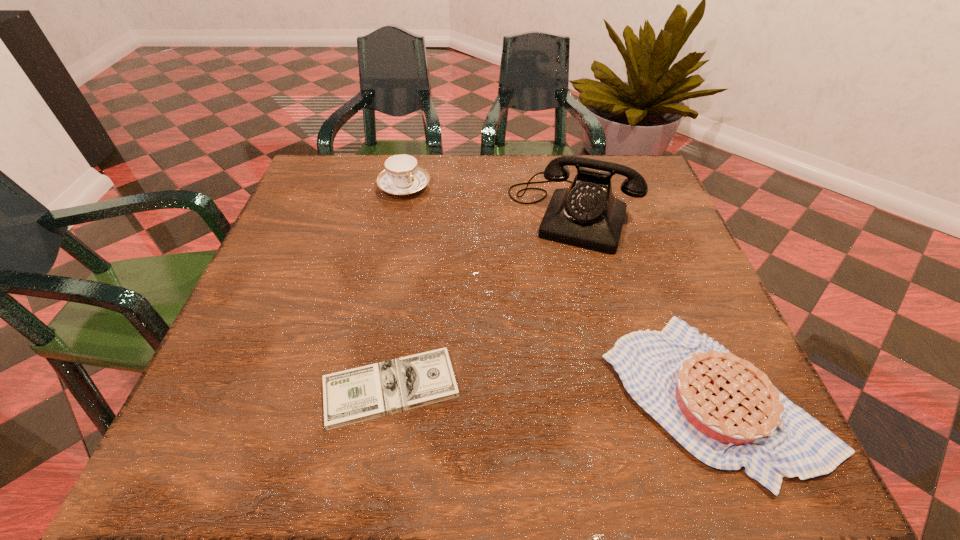
Find the location of a particular element. free spot located on the side with the handle of the second tallest object is located at coordinates (455, 241).

You are a GUI agent. You are given a task and a screenshot of the screen. Output one action in this format:
    pyautogui.click(x=<x>, y=<y>)
    Task: Click on the vacant region located 0.330m on the side with the handle of the second tallest object
    This screenshot has height=540, width=960.
    Given the screenshot: What is the action you would take?
    pyautogui.click(x=490, y=278)

Locate an element on the screen. The image size is (960, 540). telephone present at the far edge is located at coordinates (586, 214).

You are a GUI agent. You are given a task and a screenshot of the screen. Output one action in this format:
    pyautogui.click(x=<x>, y=<y>)
    Task: Click on the teacup at the far edge
    Image resolution: width=960 pixels, height=540 pixels.
    Given the screenshot: What is the action you would take?
    pyautogui.click(x=402, y=176)

At what (x,y) coordinates should I click in order to perform the action: click on dollar at the near edge. Please return your answer as a coordinate pair (x, y). The width and height of the screenshot is (960, 540). Looking at the image, I should click on (355, 395).

Find the location of a particular element. pie positioned at the near edge is located at coordinates (725, 411).

The image size is (960, 540). What are the coordinates of `pie that is at the right edge` in the screenshot? It's located at (725, 411).

What are the coordinates of `telephone that is at the right edge` in the screenshot? It's located at (586, 214).

The image size is (960, 540). Identify the location of object situated at the far right corner. (586, 214).

Find the location of a particular element. object located at the near right corner is located at coordinates (725, 411).